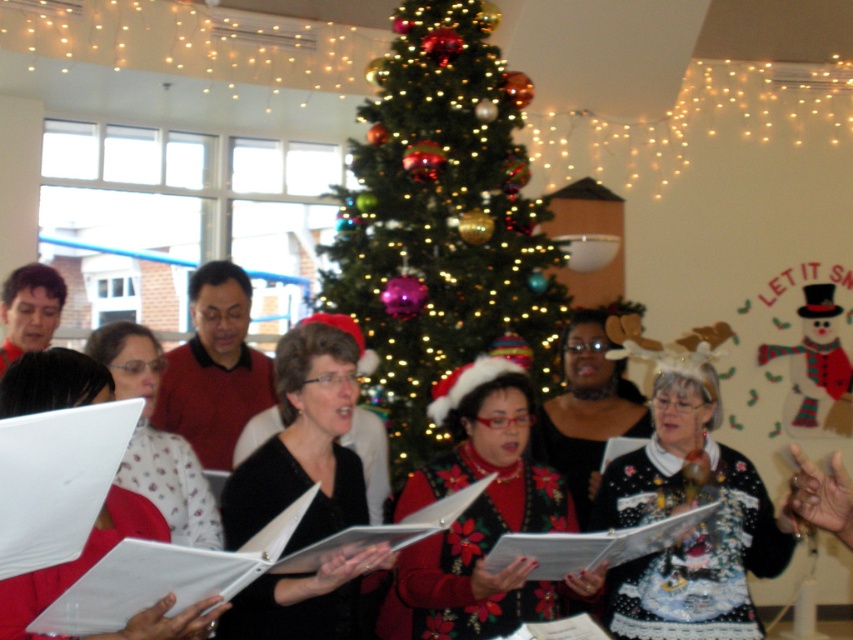
Which is more to the left, shiny green christmas tree at center or black matte sweater at center?

black matte sweater at center is more to the left.

Can you confirm if shiny green christmas tree at center is wider than black matte sweater at center?

Yes, shiny green christmas tree at center is wider than black matte sweater at center.

What do you see at coordinates (440, 221) in the screenshot? I see `shiny green christmas tree at center` at bounding box center [440, 221].

You are a GUI agent. You are given a task and a screenshot of the screen. Output one action in this format:
    pyautogui.click(x=<x>, y=<y>)
    Task: Click on the shiny green christmas tree at center
    
    Given the screenshot: What is the action you would take?
    pyautogui.click(x=440, y=221)

Can you confirm if velvet red sweater at center is taller than black matte sweater at center?

Indeed, velvet red sweater at center has a greater height compared to black matte sweater at center.

Between point (453, 429) and point (318, 364), which one is positioned in front?

Point (318, 364) is more forward.

Identify the location of velvet red sweater at center. (483, 509).

Between ugly sweater at center and black sweater at center, which one appears on the right side from the viewer's perspective?

ugly sweater at center

Does ugly sweater at center have a lesser height compared to black sweater at center?

In fact, ugly sweater at center may be taller than black sweater at center.

Identify the location of ugly sweater at center. The image size is (853, 640). pyautogui.click(x=697, y=525).

I want to click on ugly sweater at center, so click(x=697, y=525).